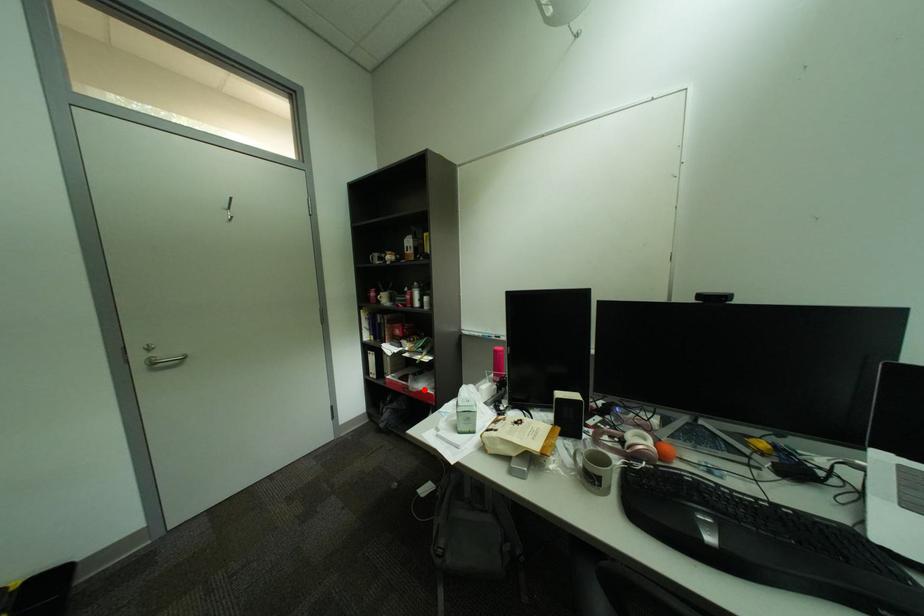
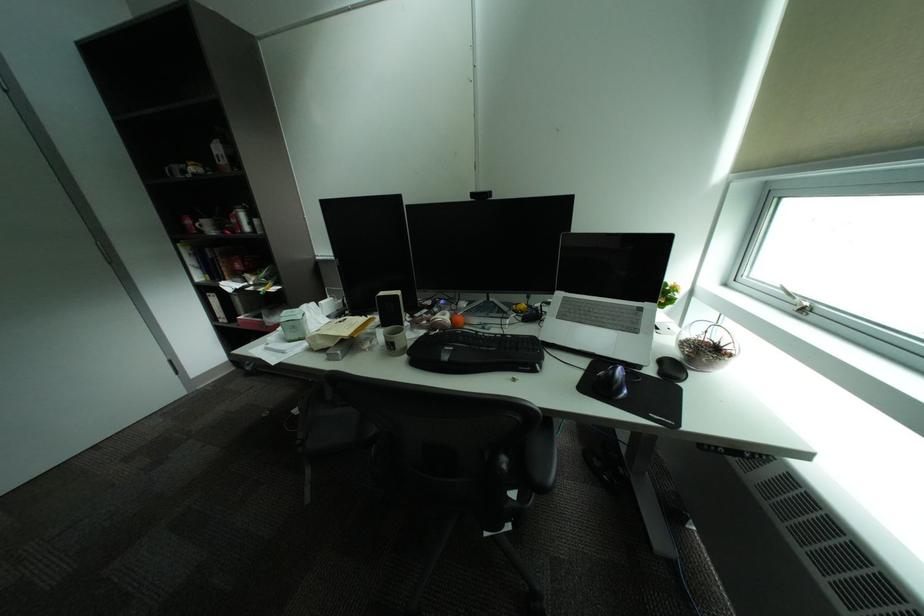
Question: I am providing you with two images of the same scene from different viewpoints. A red point is shown in image1. For the corresponding object point in image2, is it positioned nearer or farther from the camera?

Choices:
 (A) Nearer
 (B) Farther

Answer: (B)